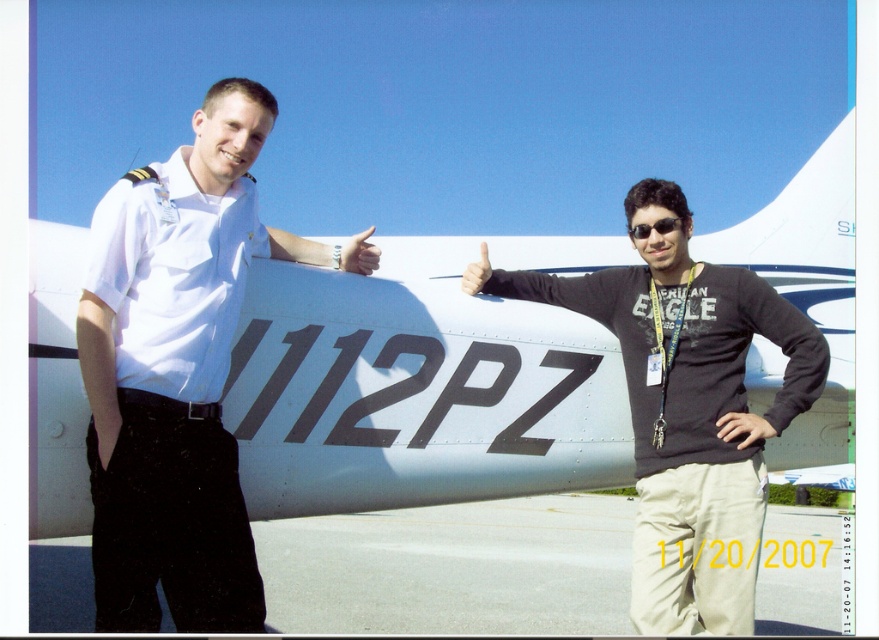
Question: Based on their relative distances, which object is farther from the white uniform shirt at center?

Choices:
 (A) matte black hand at center
 (B) matte skin at center
 (C) white metallic airplane at center
 (D) white shirt at center

Answer: (D)

Question: Which of the following is the farthest from the observer?

Choices:
 (A) white metallic airplane at center
 (B) smooth skin hand at center
 (C) white uniform shirt at center
 (D) white shirt at center

Answer: (B)

Question: Is the position of white shirt at center less distant than that of matte black hand at center?

Choices:
 (A) no
 (B) yes

Answer: (B)

Question: Observing the image, what is the correct spatial positioning of white metallic airplane at center in reference to matte black hand at center?

Choices:
 (A) below
 (B) above

Answer: (A)

Question: Considering the real-world distances, which object is closest to the smooth skin hand at center?

Choices:
 (A) matte skin at center
 (B) white shirt at center
 (C) white metallic airplane at center

Answer: (C)

Question: Can you confirm if white uniform shirt at center is positioned to the right of smooth skin hand at center?

Choices:
 (A) yes
 (B) no

Answer: (B)